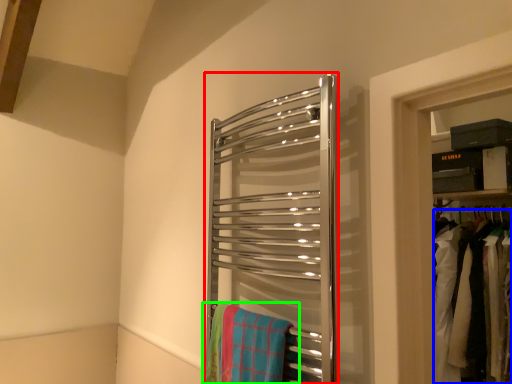
Question: Which object is the closest to the towel rack (highlighted by a red box)? Choose among these: laundry (highlighted by a blue box) or beach towel (highlighted by a green box).

Choices:
 (A) laundry
 (B) beach towel

Answer: (B)